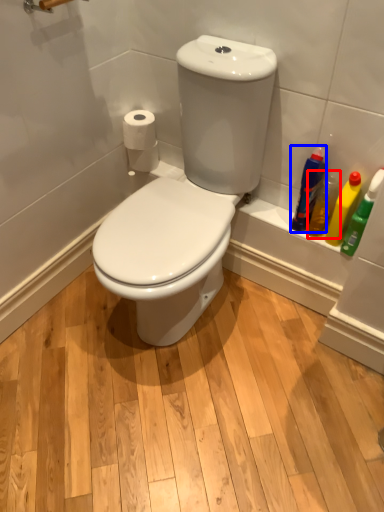
Question: Which object appears farthest to the camera in this image, cleaning product (highlighted by a red box) or cleaning product (highlighted by a blue box)?

Choices:
 (A) cleaning product
 (B) cleaning product

Answer: (A)